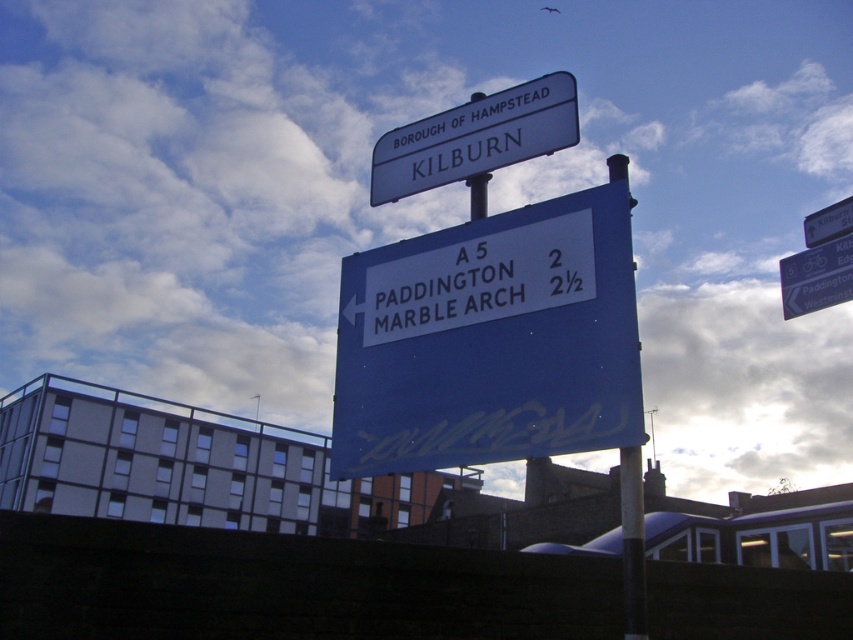
You are a delivery driver trying to read two signs on a pole. The blue painted metal sign at center and the white plastic sign at center. Which one do you need to look up to see first?

The blue painted metal sign at center is closer to the viewer than the white plastic sign at center, so you would see the blue painted metal sign at center first without needing to look up as much.